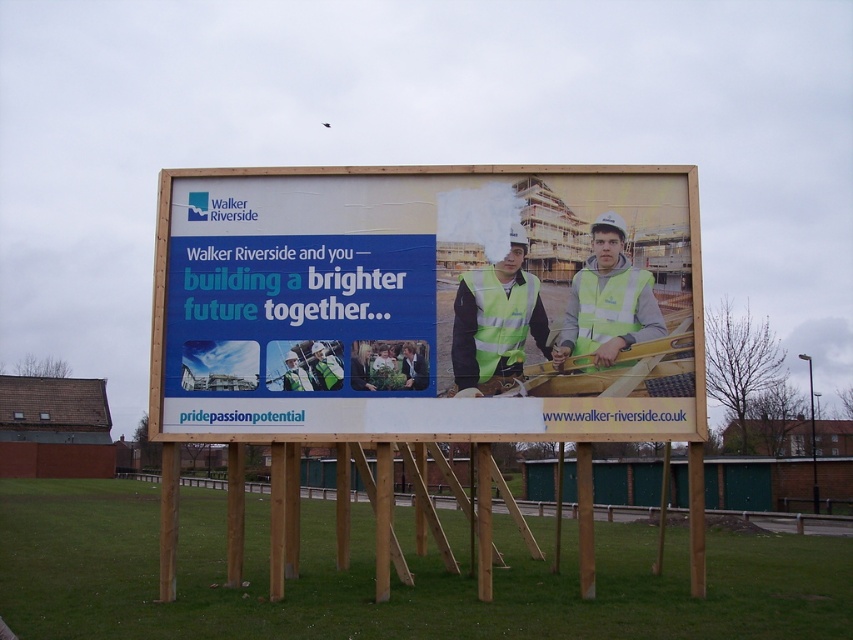
You are standing in front of the matte yellow billboard at center and want to reach the high visibility vest at center. Which direction should you move to get closer to the vest?

Since the matte yellow billboard at center is closer to you than the high visibility vest at center, you should move backward to get closer to the high visibility vest at center.

You are standing 50 feet away from the billboard. If you want to see the point at coordinates [173,346] on the billboard clearly, will you need to move closer or farther away?

The point at coordinates [173,346] is 42.35 feet away from the viewer. Since you are currently 50 feet away, you need to move closer to see it clearly.